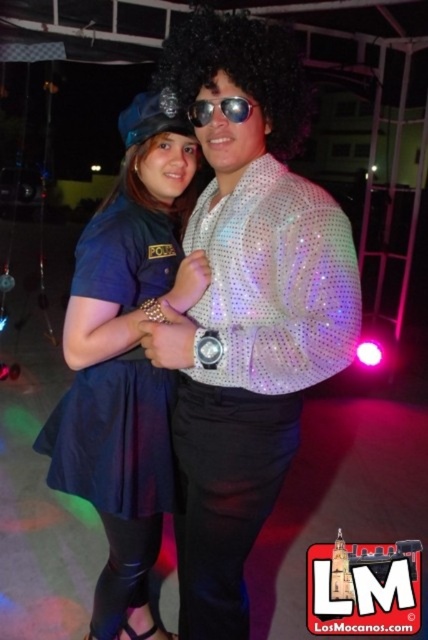
Does blue fabric skirt at center have a greater width compared to sunglasses at center?

Yes, blue fabric skirt at center is wider than sunglasses at center.

You are a GUI agent. You are given a task and a screenshot of the screen. Output one action in this format:
    pyautogui.click(x=<x>, y=<y>)
    Task: Click on the blue fabric skirt at center
    This screenshot has height=640, width=428.
    Given the screenshot: What is the action you would take?
    pyautogui.click(x=125, y=362)

The image size is (428, 640). In order to click on blue fabric skirt at center in this screenshot , I will do point(125,362).

Between shiny sequined shirt at center and sunglasses at center, which one has less height?

sunglasses at center

Is point (202, 451) positioned in front of point (234, 118)?

No, (202, 451) is further to viewer.

At what (x,y) coordinates should I click in order to perform the action: click on shiny sequined shirt at center. Please return your answer as a coordinate pair (x, y). This screenshot has width=428, height=640. Looking at the image, I should click on (246, 308).

In order to click on shiny sequined shirt at center in this screenshot , I will do `click(246, 308)`.

Consider the image. Can you confirm if shiny sequined shirt at center is thinner than blue fabric skirt at center?

Indeed, shiny sequined shirt at center has a lesser width compared to blue fabric skirt at center.

Is shiny sequined shirt at center below blue fabric skirt at center?

Incorrect, shiny sequined shirt at center is not positioned below blue fabric skirt at center.

Image resolution: width=428 pixels, height=640 pixels. What are the coordinates of `shiny sequined shirt at center` in the screenshot? It's located at (246, 308).